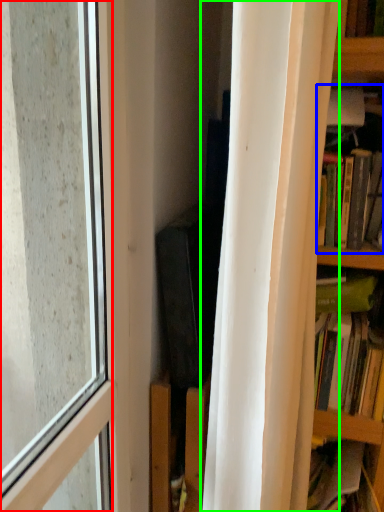
Question: Based on their relative distances, which object is nearer to window (highlighted by a red box)? Choose from book (highlighted by a blue box) and curtain (highlighted by a green box).

Choices:
 (A) book
 (B) curtain

Answer: (B)